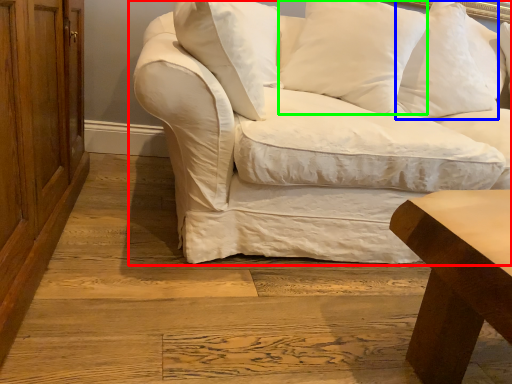
Question: Considering the real-world distances, which object is farthest from studio couch (highlighted by a red box)? pillow (highlighted by a blue box) or pillow (highlighted by a green box)?

Choices:
 (A) pillow
 (B) pillow

Answer: (A)